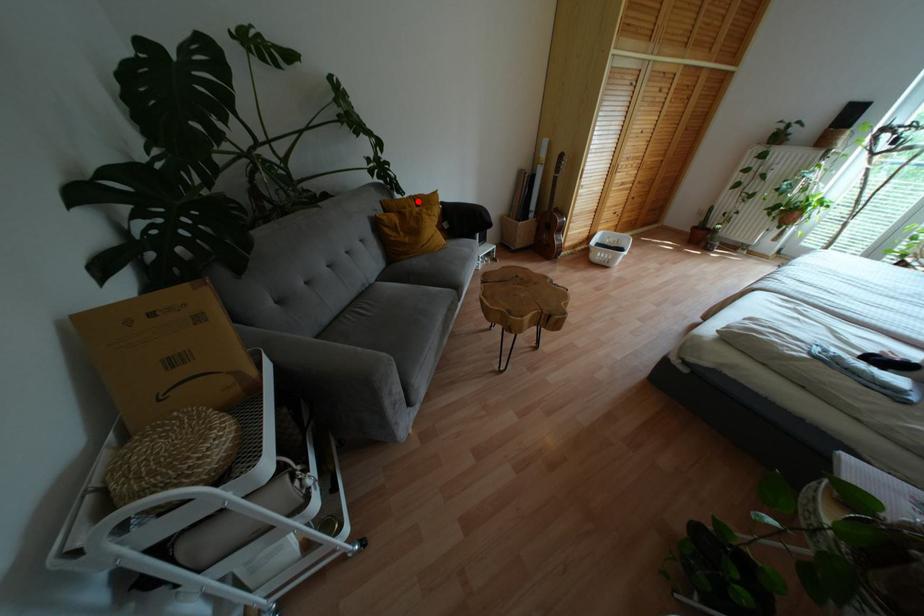
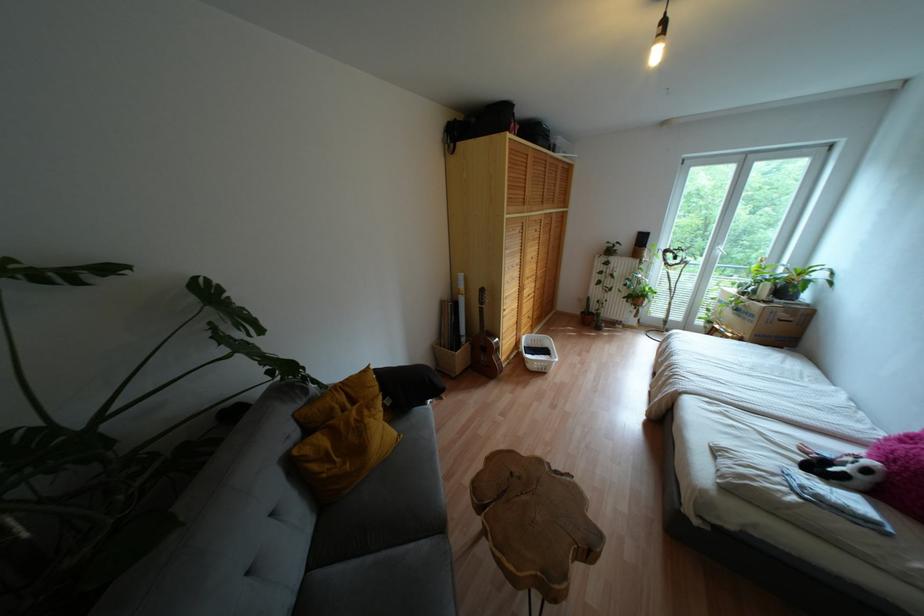
Where in the second image is the point corresponding to the highlighted location from the first image?

(348, 391)